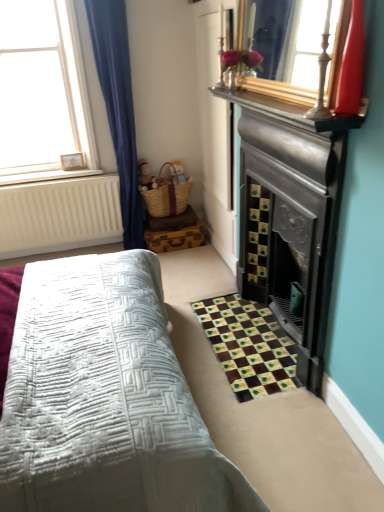
The width and height of the screenshot is (384, 512). In order to click on free location to the right of wooden picture frame at upper left in this screenshot , I will do `click(86, 170)`.